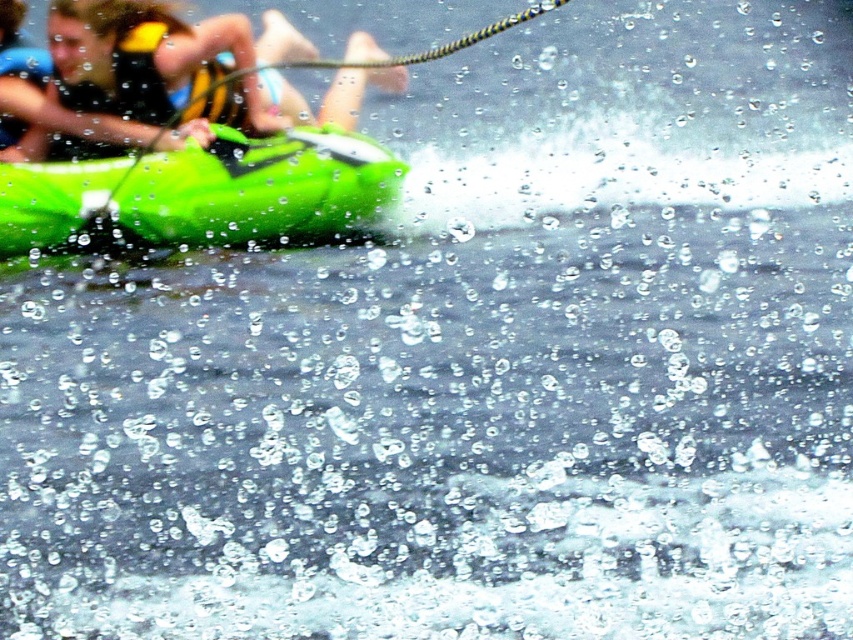
You are planning to place a 3.5 feet long board between the green matte kayak at left and the yellow life vest at upper left. Will there be enough space?

The distance between the green matte kayak at left and the yellow life vest at upper left is 4.20 feet, so yes, the 3.5 feet long board can fit between them since it is shorter than the available space.

You are a photographer trying to capture the water droplets and ripples in the foreground. You have a camera with a limited focus range. Since the green matte kayak at left and the yellow life vest at upper left are both in your view, which object will be easier to focus on due to their size?

The green matte kayak at left is bigger than the yellow life vest at upper left, so it will be easier to focus on the green matte kayak at left because larger objects are generally easier to focus on with a limited focus range.

You are navigating a boat and need to locate the green matte kayak at left. According to the coordinates provided, where should you look in the image?

The green matte kayak at left is located at coordinates point (202, 193).